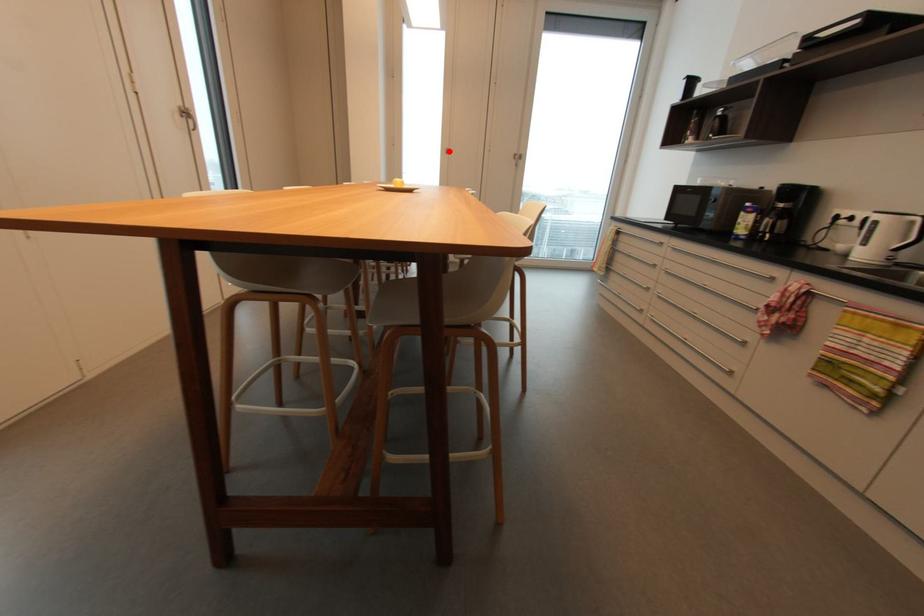
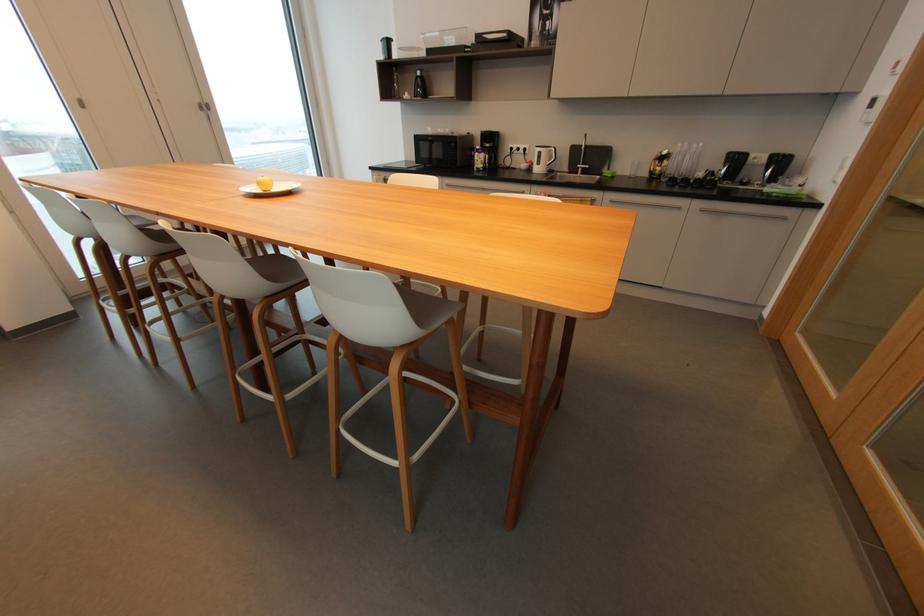
The point at the highlighted location is marked in the first image. Where is the corresponding point in the second image?

(81, 103)